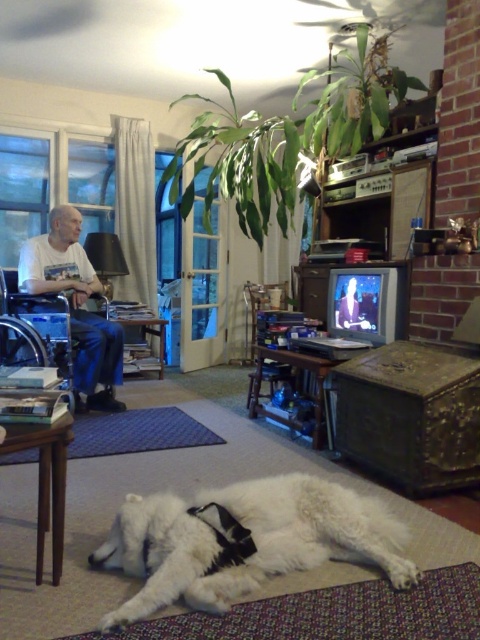
You are a guest visiting the living room and want to pet the dog. The white fluffy dog at lower center is near the white cotton shirt at left. Which object is closer to you if you are standing at the entrance?

The white fluffy dog at lower center is closer to you since it is smaller in size compared to the white cotton shirt at left, indicating it is nearer.